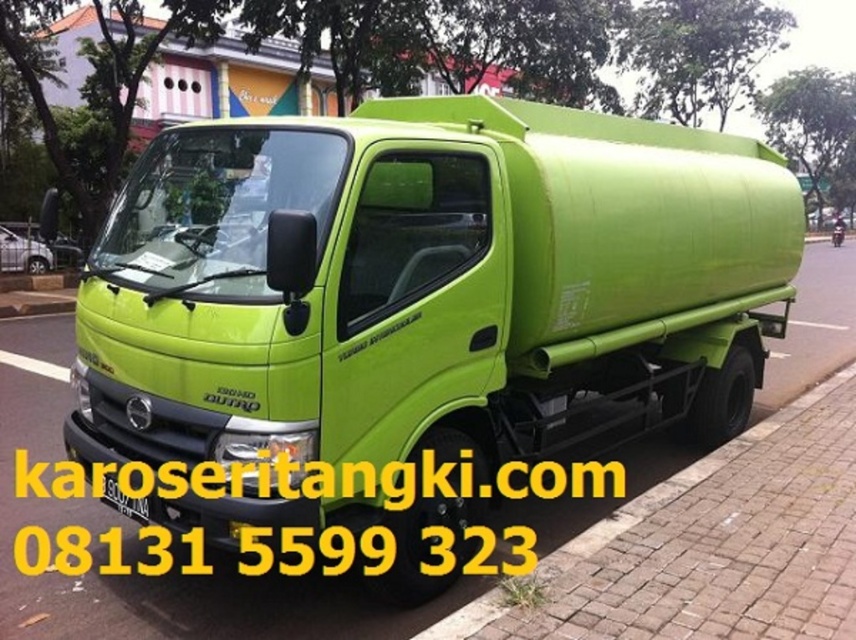
Can you confirm if green matte truck at center is bigger than brick pavement at lower right?

Indeed, green matte truck at center has a larger size compared to brick pavement at lower right.

Who is more distant from viewer, (302, 396) or (753, 429)?

Positioned behind is point (753, 429).

Describe the element at coordinates (431, 285) in the screenshot. I see `green matte truck at center` at that location.

Where is `green matte truck at center`? This screenshot has height=640, width=856. green matte truck at center is located at coordinates (431, 285).

Who is more distant from viewer, (232, 273) or (144, 513)?

The point (144, 513) is more distant.

Between green matte truck at center and yellow matte license plate at center, which one has less height?

With less height is yellow matte license plate at center.

Is point (717, 436) closer to camera compared to point (104, 484)?

No.

Identify the location of green matte truck at center. (431, 285).

Between brick pavement at lower right and yellow matte license plate at center, which one appears on the right side from the viewer's perspective?

From the viewer's perspective, brick pavement at lower right appears more on the right side.

Who is more forward, (727, 445) or (141, 502)?

Point (141, 502) is in front.

Which is behind, point (629, 512) or point (144, 508)?

The point (629, 512) is more distant.

Locate an element on the screen. brick pavement at lower right is located at coordinates (676, 483).